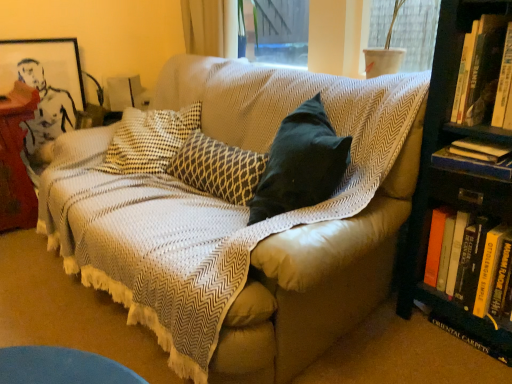
Question: From the image's perspective, would you say gold-patterned fabric pillow at center is positioned over matte black picture frame at upper left?

Choices:
 (A) no
 (B) yes

Answer: (A)

Question: Does gold-patterned fabric pillow at center turn towards matte black picture frame at upper left?

Choices:
 (A) no
 (B) yes

Answer: (A)

Question: Is gold-patterned fabric pillow at center to the right of matte black picture frame at upper left from the viewer's perspective?

Choices:
 (A) yes
 (B) no

Answer: (A)

Question: Considering the relative sizes of gold-patterned fabric pillow at center and matte black picture frame at upper left in the image provided, is gold-patterned fabric pillow at center taller than matte black picture frame at upper left?

Choices:
 (A) no
 (B) yes

Answer: (A)

Question: Is gold-patterned fabric pillow at center not near matte black picture frame at upper left?

Choices:
 (A) no
 (B) yes

Answer: (B)

Question: Is gold-patterned fabric pillow at center at the left side of matte black picture frame at upper left?

Choices:
 (A) yes
 (B) no

Answer: (B)

Question: From a real-world perspective, does textured beige couch at center stand above hardcover book at right, which ranks as the second book in bottom-to-top order?

Choices:
 (A) no
 (B) yes

Answer: (A)

Question: Considering the relative sizes of textured beige couch at center and hardcover book at right, which is the 3th book from top to bottom, in the image provided, is textured beige couch at center bigger than hardcover book at right, which is the 3th book from top to bottom,?

Choices:
 (A) yes
 (B) no

Answer: (A)

Question: Is textured beige couch at center located outside hardcover book at right, which is the 3th book from top to bottom?

Choices:
 (A) yes
 (B) no

Answer: (A)

Question: Is textured beige couch at center thinner than hardcover book at right, which is the 3th book from top to bottom?

Choices:
 (A) no
 (B) yes

Answer: (A)

Question: Is textured beige couch at center directly adjacent to hardcover book at right, which ranks as the second book in bottom-to-top order?

Choices:
 (A) yes
 (B) no

Answer: (B)

Question: Is textured beige couch at center aimed at hardcover book at right, which ranks as the second book in bottom-to-top order?

Choices:
 (A) no
 (B) yes

Answer: (A)

Question: Does hardcover book at right, placed as the first book when sorted from top to bottom, contain hardcover book at right, which ranks as the second book in bottom-to-top order?

Choices:
 (A) yes
 (B) no

Answer: (B)